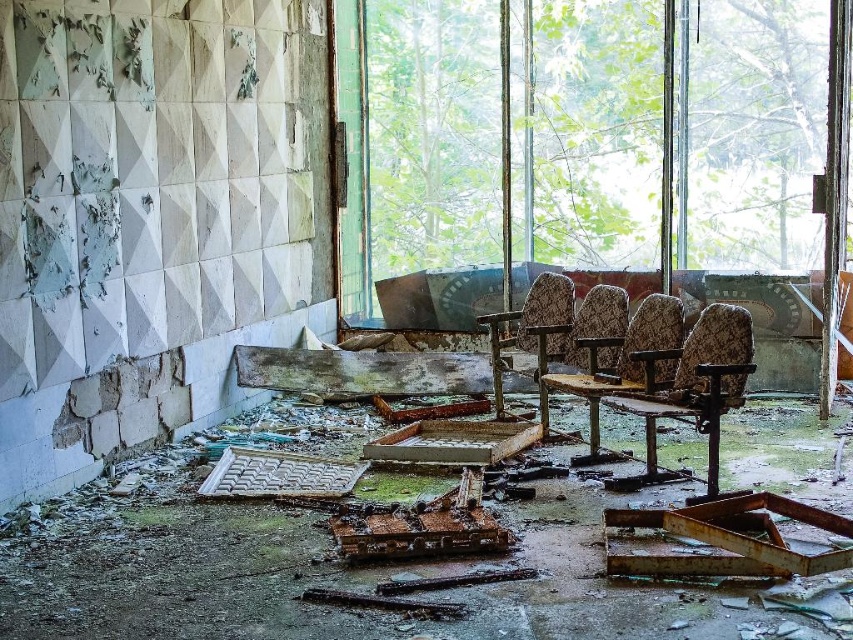
Question: Which object appears farthest from the camera in this image?

Choices:
 (A) transparent glass window at center
 (B) camouflage fabric chair at center
 (C) patterned fabric chair at center

Answer: (A)

Question: Does floral fabric chair at center have a greater width compared to patterned fabric chair at center?

Choices:
 (A) yes
 (B) no

Answer: (A)

Question: Can you confirm if transparent glass window at center is positioned below patterned fabric chair at center?

Choices:
 (A) yes
 (B) no

Answer: (B)

Question: Which point is closer to the camera?

Choices:
 (A) pos(527,67)
 (B) pos(592,394)

Answer: (B)

Question: Which object is the farthest from the floral fabric chair at center?

Choices:
 (A) patterned fabric chair at center
 (B) transparent glass window at center
 (C) camouflage fabric chair at center

Answer: (B)

Question: Is floral fabric chair at center to the left of camouflage fabric chair at center from the viewer's perspective?

Choices:
 (A) yes
 (B) no

Answer: (A)